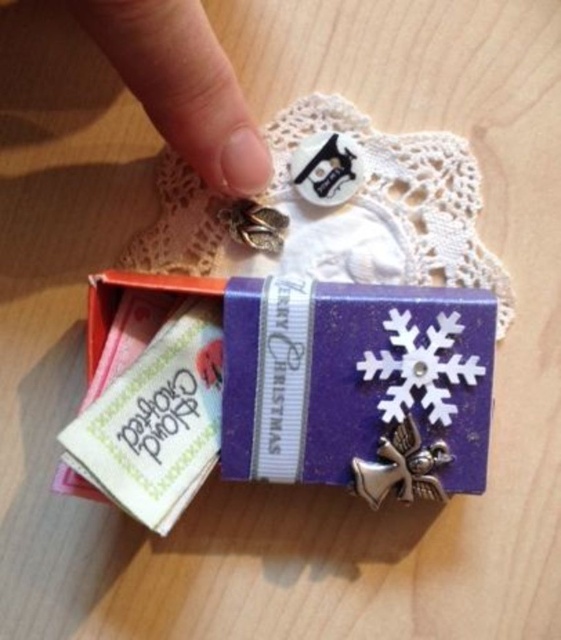
You are an assistant organizing a Christmas gift display. You need to place a new ornament exactly at the point labeled as point [173,401]. What object should you place the ornament on?

The point [173,401] corresponds to the purple shiny gift box at center, so you should place the ornament on the purple shiny gift box at center.

You are standing 40 inches away from the box. Can you reach the point at point [204,74] without moving closer?

The distance of point [204,74] from viewer is 36.41 inches, so yes, you can reach the point at point [204,74] without moving closer since you are standing 40 inches away which is farther than the point.

You are organizing a Christmas display and need to place a decorative item on the purple shiny gift box at center. Where exactly should you place it according to the coordinates provided in the description?

The purple shiny gift box at center is located at point (173, 401), so you should place the decorative item at those coordinates.